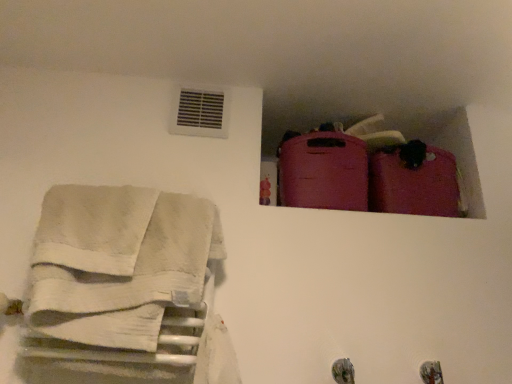
Find the location of a particular element. This screenshot has height=384, width=512. matte pink suitcase at upper right, the second luggage in the left-to-right sequence is located at coordinates (414, 180).

The height and width of the screenshot is (384, 512). I want to click on matte pink suitcase at upper right, which is the second luggage in right-to-left order, so click(x=323, y=171).

I want to click on white plastic vent at upper center, so click(x=200, y=113).

Is matte pink suitcase at upper right, the 1th luggage in the left-to-right sequence, placed right next to white cotton towels at left?

No.

From the image's perspective, who appears lower, matte pink suitcase at upper right, the 1th luggage in the left-to-right sequence, or white cotton towels at left?

From the image's view, white cotton towels at left is below.

Considering the relative sizes of matte pink suitcase at upper right, the 1th luggage in the left-to-right sequence, and white cotton towels at left in the image provided, is matte pink suitcase at upper right, the 1th luggage in the left-to-right sequence, wider than white cotton towels at left?

Correct, the width of matte pink suitcase at upper right, the 1th luggage in the left-to-right sequence, exceeds that of white cotton towels at left.

From the image's perspective, would you say white plastic vent at upper center is positioned over matte pink suitcase at upper right, the 1th luggage in the left-to-right sequence?

Yes, from the image's perspective, white plastic vent at upper center is over matte pink suitcase at upper right, the 1th luggage in the left-to-right sequence.

From a real-world perspective, is white plastic vent at upper center physically located above or below matte pink suitcase at upper right, the 1th luggage in the left-to-right sequence?

Clearly, from a real-world perspective, white plastic vent at upper center is above matte pink suitcase at upper right, the 1th luggage in the left-to-right sequence.

Between white plastic vent at upper center and matte pink suitcase at upper right, the 1th luggage in the left-to-right sequence, which one appears on the left side from the viewer's perspective?

white plastic vent at upper center.

How far apart are matte pink suitcase at upper right, which is the second luggage in right-to-left order, and matte pink suitcase at upper right, the second luggage in the left-to-right sequence?

A distance of 17.34 centimeters exists between matte pink suitcase at upper right, which is the second luggage in right-to-left order, and matte pink suitcase at upper right, the second luggage in the left-to-right sequence.

Is matte pink suitcase at upper right, the 1th luggage in the left-to-right sequence, outside of matte pink suitcase at upper right, marked as the 1th luggage in a right-to-left arrangement?

Yes, matte pink suitcase at upper right, the 1th luggage in the left-to-right sequence, is not within matte pink suitcase at upper right, marked as the 1th luggage in a right-to-left arrangement.

From the image's perspective, is matte pink suitcase at upper right, which is the second luggage in right-to-left order, located above matte pink suitcase at upper right, marked as the 1th luggage in a right-to-left arrangement?

Yes, from the image's perspective, matte pink suitcase at upper right, which is the second luggage in right-to-left order, is over matte pink suitcase at upper right, marked as the 1th luggage in a right-to-left arrangement.

Between matte pink suitcase at upper right, the 1th luggage in the left-to-right sequence, and matte pink suitcase at upper right, the second luggage in the left-to-right sequence, which one has more height?

matte pink suitcase at upper right, the 1th luggage in the left-to-right sequence, is taller.

From the image's perspective, which one is positioned lower, white cotton towels at left or matte pink suitcase at upper right, the 1th luggage in the left-to-right sequence?

white cotton towels at left appears lower in the image.

Does white cotton towels at left have a lesser height compared to matte pink suitcase at upper right, which is the second luggage in right-to-left order?

No.

Is white cotton towels at left facing towards matte pink suitcase at upper right, the 1th luggage in the left-to-right sequence?

No, white cotton towels at left is not oriented towards matte pink suitcase at upper right, the 1th luggage in the left-to-right sequence.

Which object is closer to the camera, white cotton towels at left or matte pink suitcase at upper right, the 1th luggage in the left-to-right sequence?

white cotton towels at left is more forward.

Based on the photo, from a real-world perspective, does matte pink suitcase at upper right, marked as the 1th luggage in a right-to-left arrangement, stand above white plastic vent at upper center?

Actually, matte pink suitcase at upper right, marked as the 1th luggage in a right-to-left arrangement, is physically below white plastic vent at upper center in the real world.

Does point (374, 161) appear closer or farther from the camera than point (204, 122)?

Clearly, point (374, 161) is more distant from the camera than point (204, 122).

Is matte pink suitcase at upper right, the second luggage in the left-to-right sequence, beside white plastic vent at upper center?

No, matte pink suitcase at upper right, the second luggage in the left-to-right sequence, is not beside white plastic vent at upper center.

From the image's perspective, is matte pink suitcase at upper right, marked as the 1th luggage in a right-to-left arrangement, above or below white plastic vent at upper center?

Clearly, from the image's perspective, matte pink suitcase at upper right, marked as the 1th luggage in a right-to-left arrangement, is below white plastic vent at upper center.

Can you tell me how much matte pink suitcase at upper right, the second luggage in the left-to-right sequence, and white cotton towels at left differ in facing direction?

They differ by 3.79 degrees in their facing directions.

Consider the image. Is white cotton towels at left surrounded by matte pink suitcase at upper right, the second luggage in the left-to-right sequence?

No.

Can you confirm if matte pink suitcase at upper right, the second luggage in the left-to-right sequence, is positioned to the right of white cotton towels at left?

Indeed, matte pink suitcase at upper right, the second luggage in the left-to-right sequence, is positioned on the right side of white cotton towels at left.

Does point (441, 216) come behind point (57, 304)?

Yes, it is.

Which point is more distant from viewer, [189,100] or [435,191]?

Positioned behind is point [435,191].

Can you tell me how much white plastic vent at upper center and matte pink suitcase at upper right, the second luggage in the left-to-right sequence, differ in facing direction?

The angle between the facing direction of white plastic vent at upper center and the facing direction of matte pink suitcase at upper right, the second luggage in the left-to-right sequence, is 3.38 degrees.

From a real-world perspective, does white plastic vent at upper center sit lower than matte pink suitcase at upper right, marked as the 1th luggage in a right-to-left arrangement?

No.

Considering the sizes of objects white plastic vent at upper center and matte pink suitcase at upper right, marked as the 1th luggage in a right-to-left arrangement, in the image provided, who is taller, white plastic vent at upper center or matte pink suitcase at upper right, marked as the 1th luggage in a right-to-left arrangement,?

Standing taller between the two is matte pink suitcase at upper right, marked as the 1th luggage in a right-to-left arrangement.

There is a white cotton towels at left. Where is `the 2nd luggage above it (from the image's perspective)`? The width and height of the screenshot is (512, 384). the 2nd luggage above it (from the image's perspective) is located at coordinates (323, 171).

The image size is (512, 384). I want to click on air conditioning above the matte pink suitcase at upper right, the 1th luggage in the left-to-right sequence (from a real-world perspective), so click(200, 113).

From the picture: Looking at the image, which one is located further to matte pink suitcase at upper right, which is the second luggage in right-to-left order, matte pink suitcase at upper right, the second luggage in the left-to-right sequence, or white plastic vent at upper center?

white plastic vent at upper center lies further to matte pink suitcase at upper right, which is the second luggage in right-to-left order, than the other object.

Considering their positions, is matte pink suitcase at upper right, the second luggage in the left-to-right sequence, positioned further to white cotton towels at left than white plastic vent at upper center?

matte pink suitcase at upper right, the second luggage in the left-to-right sequence, lies further to white cotton towels at left than the other object.

When comparing their distances from white plastic vent at upper center, does matte pink suitcase at upper right, which is the second luggage in right-to-left order, or matte pink suitcase at upper right, marked as the 1th luggage in a right-to-left arrangement, seem further?

Based on the image, matte pink suitcase at upper right, marked as the 1th luggage in a right-to-left arrangement, appears to be further to white plastic vent at upper center.

Estimate the real-world distances between objects in this image. Which object is further from white cotton towels at left, matte pink suitcase at upper right, which is the second luggage in right-to-left order, or matte pink suitcase at upper right, the second luggage in the left-to-right sequence?

matte pink suitcase at upper right, the second luggage in the left-to-right sequence.

From the image, which object appears to be farther from matte pink suitcase at upper right, the second luggage in the left-to-right sequence, white cotton towels at left or white plastic vent at upper center?

Based on the image, white cotton towels at left appears to be further to matte pink suitcase at upper right, the second luggage in the left-to-right sequence.

Based on their spatial positions, is matte pink suitcase at upper right, which is the second luggage in right-to-left order, or white cotton towels at left closer to white plastic vent at upper center?

matte pink suitcase at upper right, which is the second luggage in right-to-left order, lies closer to white plastic vent at upper center than the other object.

Looking at the image, which one is located further to matte pink suitcase at upper right, the 1th luggage in the left-to-right sequence, white plastic vent at upper center or white cotton towels at left?

white cotton towels at left.

In the scene shown: Based on their spatial positions, is white plastic vent at upper center or matte pink suitcase at upper right, marked as the 1th luggage in a right-to-left arrangement, closer to white cotton towels at left?

white plastic vent at upper center.

This screenshot has width=512, height=384. I want to click on air conditioning between white cotton towels at left and matte pink suitcase at upper right, marked as the 1th luggage in a right-to-left arrangement, in the horizontal direction, so click(x=200, y=113).

Where is `luggage between white plastic vent at upper center and matte pink suitcase at upper right, the second luggage in the left-to-right sequence, in the horizontal direction`? The image size is (512, 384). luggage between white plastic vent at upper center and matte pink suitcase at upper right, the second luggage in the left-to-right sequence, in the horizontal direction is located at coordinates (323, 171).

Where is `luggage between white cotton towels at left and matte pink suitcase at upper right, marked as the 1th luggage in a right-to-left arrangement, in the horizontal direction`? luggage between white cotton towels at left and matte pink suitcase at upper right, marked as the 1th luggage in a right-to-left arrangement, in the horizontal direction is located at coordinates (323, 171).

Where is `air conditioning between white cotton towels at left and matte pink suitcase at upper right, which is the second luggage in right-to-left order, from left to right`? air conditioning between white cotton towels at left and matte pink suitcase at upper right, which is the second luggage in right-to-left order, from left to right is located at coordinates (200, 113).